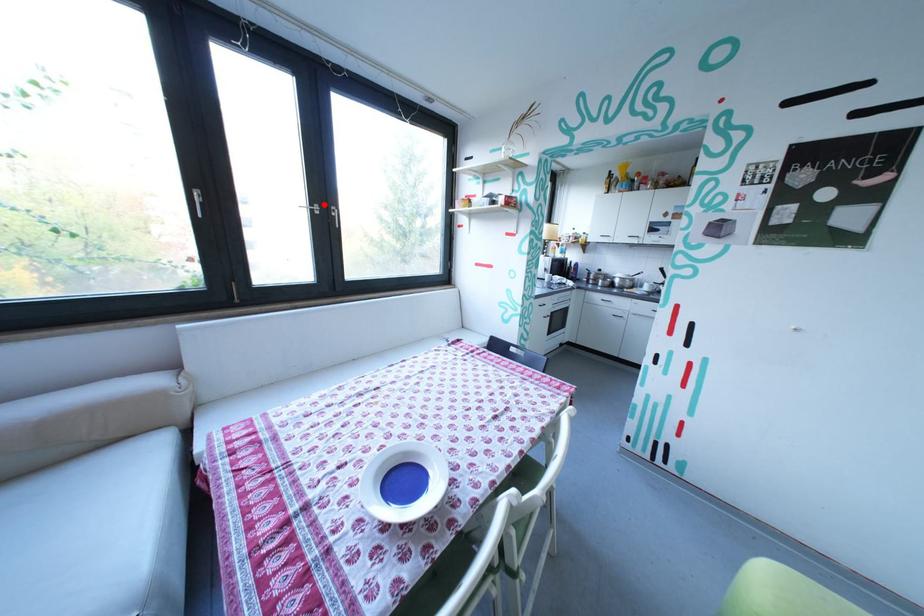
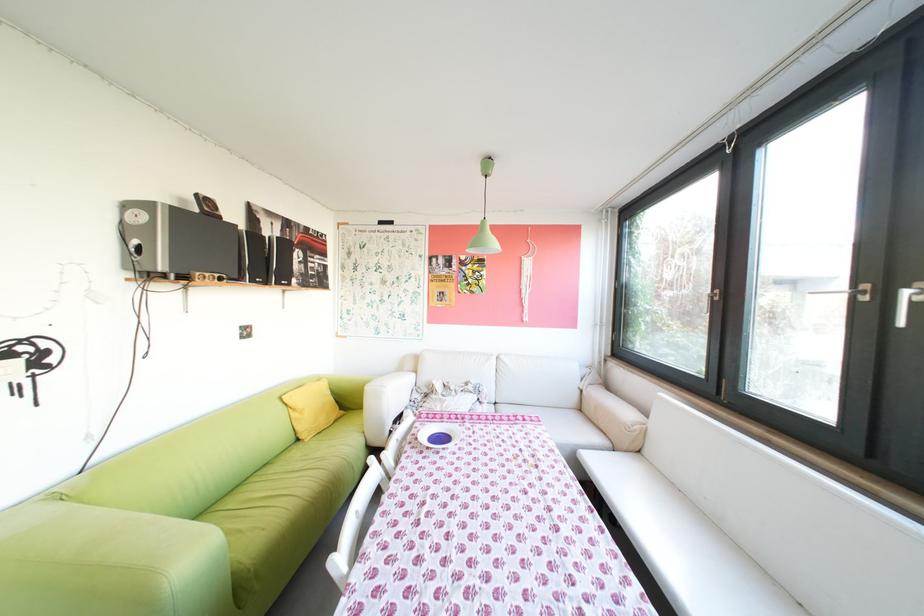
Find the pixel in the second image that matches the highlighted location in the first image.

(867, 285)